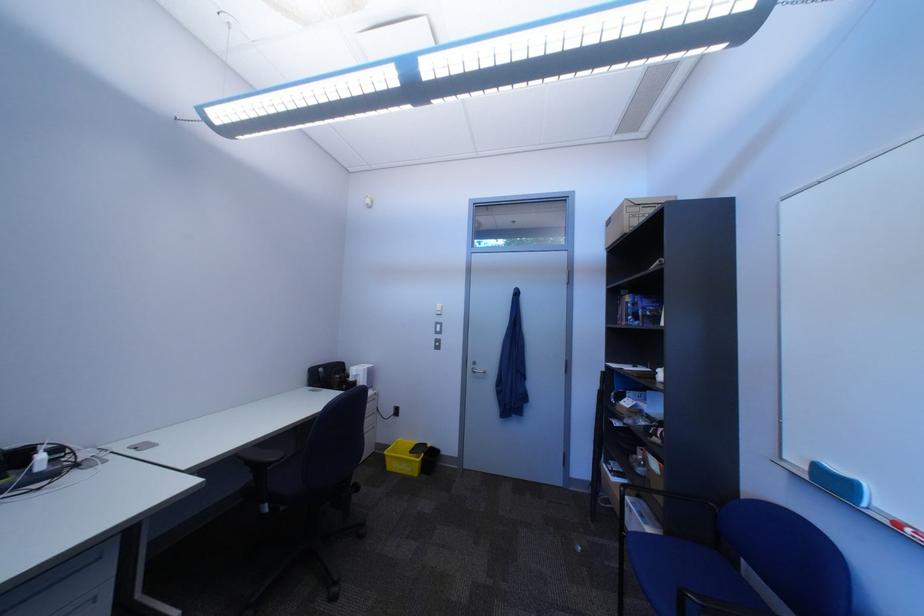
The location [906,530] corresponds to which object?

It corresponds to the red whiteboard marker in the image.